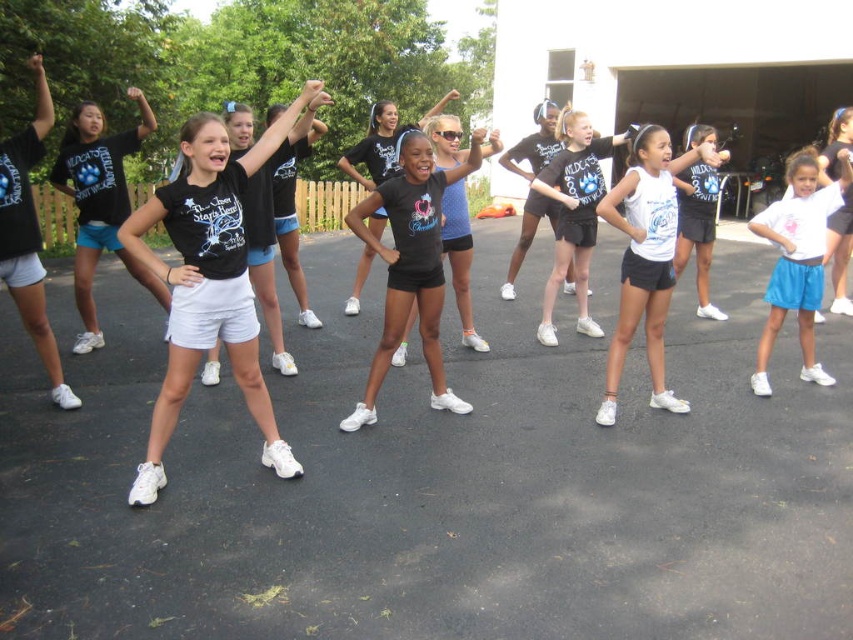
Who is lower down, black matte shorts at center or white matte shorts at lower right?

black matte shorts at center is below.

Can you confirm if black matte shorts at center is smaller than white matte shorts at lower right?

Correct, black matte shorts at center occupies less space than white matte shorts at lower right.

Between point (138, 218) and point (834, 218), which one is positioned in front?

Point (138, 218)

The width and height of the screenshot is (853, 640). Find the location of `black matte shorts at center`. black matte shorts at center is located at coordinates (209, 282).

Who is more distant from viewer, (149, 458) or (796, 298)?

Point (796, 298)

Is black matte shorts at center taller than white cotton shirt at center?

Correct, black matte shorts at center is much taller as white cotton shirt at center.

Which is behind, point (241, 262) or point (795, 259)?

The point (795, 259) is behind.

Where is `black matte shorts at center`? This screenshot has width=853, height=640. black matte shorts at center is located at coordinates (209, 282).

Can you confirm if white matte tank top at center is positioned above white matte shorts at lower right?

Actually, white matte tank top at center is below white matte shorts at lower right.

Does white matte tank top at center have a lesser width compared to white matte shorts at lower right?

Indeed, white matte tank top at center has a lesser width compared to white matte shorts at lower right.

This screenshot has width=853, height=640. What are the coordinates of `white matte tank top at center` in the screenshot? It's located at (646, 257).

I want to click on white matte tank top at center, so click(x=646, y=257).